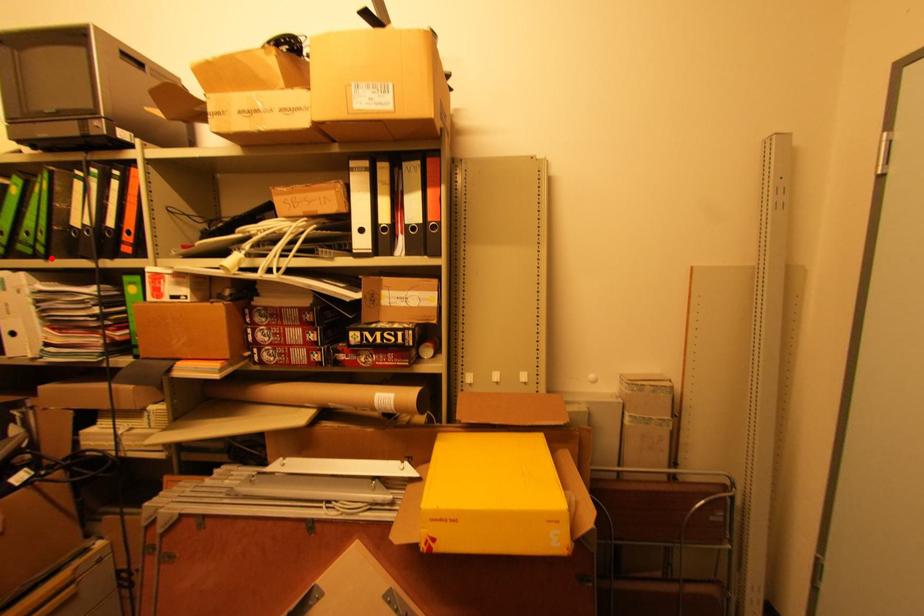
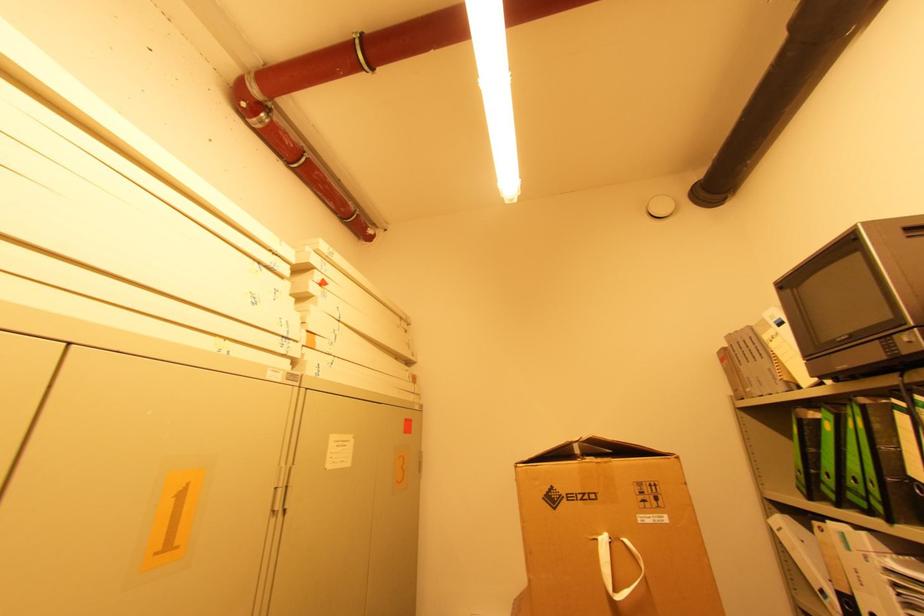
Where in the second image is the point corresponding to the highlighted location from the first image?

(894, 522)